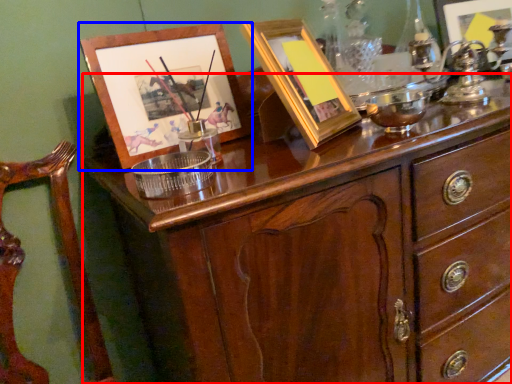
Question: Which point is closer to the camera, chest of drawers (highlighted by a red box) or picture frame (highlighted by a blue box)?

Choices:
 (A) chest of drawers
 (B) picture frame

Answer: (A)